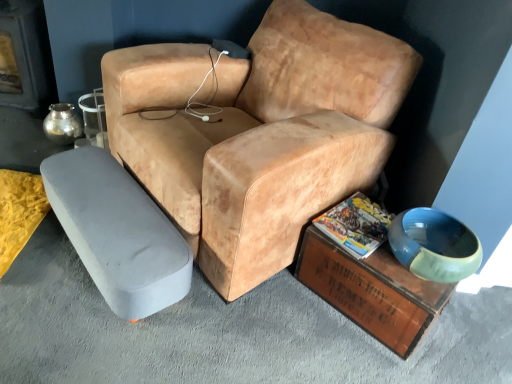
What do you see at coordinates (225, 333) in the screenshot? I see `smooth gray concrete at lower left` at bounding box center [225, 333].

The image size is (512, 384). I want to click on wooden crate at lower right, placed as the 2th table when sorted from left to right, so click(372, 291).

This screenshot has width=512, height=384. What do you see at coordinates (356, 225) in the screenshot?
I see `matte paper magazine at lower right` at bounding box center [356, 225].

Describe the element at coordinates (118, 232) in the screenshot. I see `gray fabric ottoman at lower left, which is the 2th table in right-to-left order` at that location.

Identify the location of smooth gray concrete at lower left. Image resolution: width=512 pixels, height=384 pixels. (225, 333).

Based on the photo, from a real-world perspective, which is physically below, metallic silver fireplace at left or gray fabric ottoman at lower left, which is the 2th table in right-to-left order?

gray fabric ottoman at lower left, which is the 2th table in right-to-left order.

Which point is more forward, (6, 98) or (127, 305)?

The point (127, 305) is closer.

Which object is thinner, metallic silver fireplace at left or gray fabric ottoman at lower left, which is the 2th table in right-to-left order?

Thinner between the two is gray fabric ottoman at lower left, which is the 2th table in right-to-left order.

Can you tell me how much metallic silver fireplace at left and gray fabric ottoman at lower left, which is the 2th table in right-to-left order, differ in facing direction?

46.8 degrees separate the facing orientations of metallic silver fireplace at left and gray fabric ottoman at lower left, which is the 2th table in right-to-left order.

Is smooth gray concrete at lower left touching wooden crate at lower right, placed as the 2th table when sorted from left to right?

No, smooth gray concrete at lower left is not with wooden crate at lower right, placed as the 2th table when sorted from left to right.

Is smooth gray concrete at lower left looking in the opposite direction of wooden crate at lower right, placed as the first table when sorted from right to left?

smooth gray concrete at lower left is not turned away from wooden crate at lower right, placed as the first table when sorted from right to left.

Which is closer, (34, 291) or (362, 267)?

Point (34, 291).

Is smooth gray concrete at lower left bigger or smaller than wooden crate at lower right, placed as the first table when sorted from right to left?

smooth gray concrete at lower left is bigger than wooden crate at lower right, placed as the first table when sorted from right to left.

In the image, there is a wooden crate at lower right, placed as the 2th table when sorted from left to right. Where is `fireplace above it (from the image's perspective)`? This screenshot has width=512, height=384. fireplace above it (from the image's perspective) is located at coordinates (25, 57).

From the image's perspective, who appears lower, wooden crate at lower right, placed as the 2th table when sorted from left to right, or metallic silver fireplace at left?

wooden crate at lower right, placed as the 2th table when sorted from left to right, is shown below in the image.

Is wooden crate at lower right, placed as the first table when sorted from right to left, spatially inside metallic silver fireplace at left, or outside of it?

wooden crate at lower right, placed as the first table when sorted from right to left, cannot be found inside metallic silver fireplace at left.

Are wooden crate at lower right, placed as the 2th table when sorted from left to right, and metallic silver fireplace at left making contact?

No, wooden crate at lower right, placed as the 2th table when sorted from left to right, is not in contact with metallic silver fireplace at left.

Is smooth gray concrete at lower left surrounded by leather-like tan chair at center?

No, smooth gray concrete at lower left is not a part of leather-like tan chair at center.

From the image's perspective, which is below, leather-like tan chair at center or smooth gray concrete at lower left?

smooth gray concrete at lower left, from the image's perspective.

Consider the image. Considering the sizes of objects leather-like tan chair at center and smooth gray concrete at lower left in the image provided, who is wider, leather-like tan chair at center or smooth gray concrete at lower left?

With larger width is smooth gray concrete at lower left.

Is matte paper magazine at lower right taller than gray fabric ottoman at lower left, acting as the first table starting from the left?

In fact, matte paper magazine at lower right may be shorter than gray fabric ottoman at lower left, acting as the first table starting from the left.

How many degrees apart are the facing directions of matte paper magazine at lower right and gray fabric ottoman at lower left, acting as the first table starting from the left?

matte paper magazine at lower right and gray fabric ottoman at lower left, acting as the first table starting from the left, are facing 7.46 degrees away from each other.

Does point (369, 233) come closer to viewer compared to point (144, 244)?

No.

Is matte paper magazine at lower right completely or partially outside of gray fabric ottoman at lower left, which is the 2th table in right-to-left order?

matte paper magazine at lower right lies outside gray fabric ottoman at lower left, which is the 2th table in right-to-left order,'s area.

Is leather-like tan chair at center located within wooden crate at lower right, placed as the first table when sorted from right to left?

That's incorrect, leather-like tan chair at center is not inside wooden crate at lower right, placed as the first table when sorted from right to left.

Which of these two, wooden crate at lower right, placed as the first table when sorted from right to left, or leather-like tan chair at center, is smaller?

wooden crate at lower right, placed as the first table when sorted from right to left, is smaller.

From a real-world perspective, is matte paper magazine at lower right located beneath leather-like tan chair at center?

Yes.

Is matte paper magazine at lower right far away from leather-like tan chair at center?

They are positioned close to each other.

Is matte paper magazine at lower right outside of leather-like tan chair at center?

Yes, matte paper magazine at lower right is located beyond the bounds of leather-like tan chair at center.

You are a GUI agent. You are given a task and a screenshot of the screen. Output one action in this format:
    pyautogui.click(x=<x>, y=<y>)
    Task: Click on the fireplace behind the gray fabric ottoman at lower left, acting as the first table starting from the left
    
    Given the screenshot: What is the action you would take?
    pyautogui.click(x=25, y=57)

In the image, there is a wooden crate at lower right, placed as the first table when sorted from right to left. Identify the location of concrete below it (from a real-world perspective). This screenshot has height=384, width=512. (225, 333).

From the image, which object appears to be farther from smooth gray concrete at lower left, wooden crate at lower right, placed as the first table when sorted from right to left, or metallic silver fireplace at left?

The object further to smooth gray concrete at lower left is metallic silver fireplace at left.

Based on their spatial positions, is gray fabric ottoman at lower left, which is the 2th table in right-to-left order, or matte paper magazine at lower right closer to metallic silver fireplace at left?

Based on the image, gray fabric ottoman at lower left, which is the 2th table in right-to-left order, appears to be nearer to metallic silver fireplace at left.

When comparing their distances from metallic silver fireplace at left, does matte paper magazine at lower right or leather-like tan chair at center seem closer?

leather-like tan chair at center is positioned closer to the anchor metallic silver fireplace at left.

Estimate the real-world distances between objects in this image. Which object is further from wooden crate at lower right, placed as the first table when sorted from right to left, gray fabric ottoman at lower left, which is the 2th table in right-to-left order, or metallic silver fireplace at left?

metallic silver fireplace at left is further to wooden crate at lower right, placed as the first table when sorted from right to left.

Looking at this image, estimate the real-world distances between objects in this image. Which object is closer to gray fabric ottoman at lower left, which is the 2th table in right-to-left order, leather-like tan chair at center or matte paper magazine at lower right?

The object closer to gray fabric ottoman at lower left, which is the 2th table in right-to-left order, is leather-like tan chair at center.

When comparing their distances from metallic silver fireplace at left, does matte paper magazine at lower right or wooden crate at lower right, placed as the first table when sorted from right to left, seem further?

The object further to metallic silver fireplace at left is wooden crate at lower right, placed as the first table when sorted from right to left.

In the scene shown: Which object lies further to the anchor point wooden crate at lower right, placed as the 2th table when sorted from left to right, metallic silver fireplace at left or matte paper magazine at lower right?

Among the two, metallic silver fireplace at left is located further to wooden crate at lower right, placed as the 2th table when sorted from left to right.

Based on their spatial positions, is metallic silver fireplace at left or wooden crate at lower right, placed as the 2th table when sorted from left to right, further from smooth gray concrete at lower left?

metallic silver fireplace at left lies further to smooth gray concrete at lower left than the other object.

Identify the location of concrete between metallic silver fireplace at left and wooden crate at lower right, placed as the 2th table when sorted from left to right, from left to right. The height and width of the screenshot is (384, 512). (225, 333).

Where is `chair located between gray fabric ottoman at lower left, which is the 2th table in right-to-left order, and matte paper magazine at lower right in the left-right direction`? This screenshot has height=384, width=512. chair located between gray fabric ottoman at lower left, which is the 2th table in right-to-left order, and matte paper magazine at lower right in the left-right direction is located at coordinates (258, 133).

I want to click on magazine situated between gray fabric ottoman at lower left, acting as the first table starting from the left, and wooden crate at lower right, placed as the first table when sorted from right to left, from left to right, so pos(356,225).

The image size is (512, 384). Find the location of `concrete located between gray fabric ottoman at lower left, acting as the first table starting from the left, and matte paper magazine at lower right in the left-right direction`. concrete located between gray fabric ottoman at lower left, acting as the first table starting from the left, and matte paper magazine at lower right in the left-right direction is located at coordinates (225, 333).